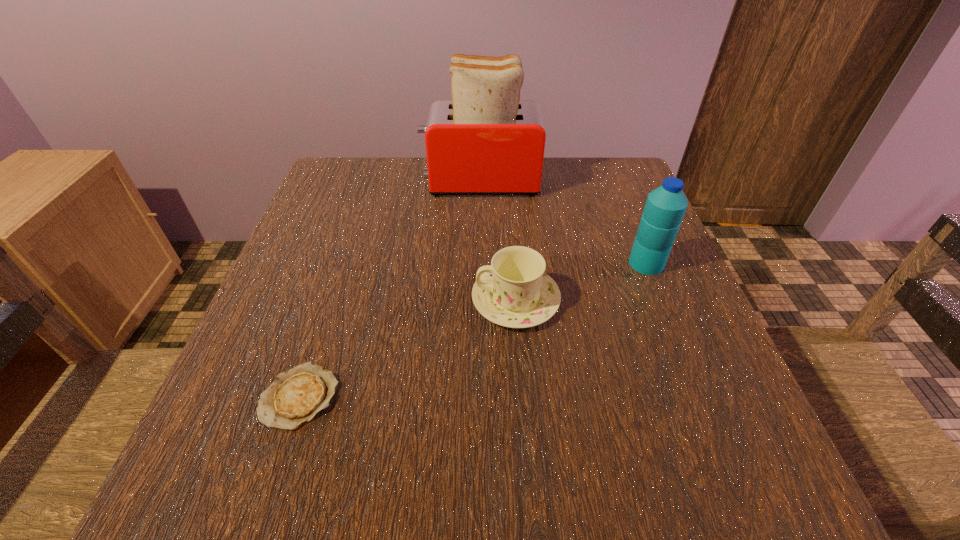
Where is `free space located 0.170m on the back of the water bottle`? Image resolution: width=960 pixels, height=540 pixels. free space located 0.170m on the back of the water bottle is located at coordinates (623, 205).

Find the location of a particular element. This screenshot has height=540, width=960. vacant area situated on the handle side of the chinaware is located at coordinates (402, 300).

The width and height of the screenshot is (960, 540). I want to click on vacant space positioned 0.320m on the handle side of the chinaware, so click(x=301, y=300).

Identify the location of vacant space situated 0.320m on the handle side of the chinaware. The width and height of the screenshot is (960, 540). (301, 300).

Where is `vacant area located 0.330m on the back of the shortest object`? The width and height of the screenshot is (960, 540). vacant area located 0.330m on the back of the shortest object is located at coordinates (351, 238).

At what (x,y) coordinates should I click in order to perform the action: click on object situated at the far edge. Please return your answer as a coordinate pair (x, y). The image size is (960, 540). Looking at the image, I should click on (485, 141).

This screenshot has height=540, width=960. I want to click on object present at the left edge, so click(296, 396).

You are a GUI agent. You are given a task and a screenshot of the screen. Output one action in this format:
    pyautogui.click(x=<x>, y=<y>)
    Task: Click on the object present at the right edge
    
    Given the screenshot: What is the action you would take?
    pyautogui.click(x=665, y=207)

In the image, there is a desktop. At what (x,y) coordinates should I click in order to perform the action: click on vacant space at the far edge. Please return your answer as a coordinate pair (x, y). The height and width of the screenshot is (540, 960). Looking at the image, I should click on (570, 197).

In the image, there is a desktop. Where is `vacant area at the near edge`? The image size is (960, 540). vacant area at the near edge is located at coordinates (412, 491).